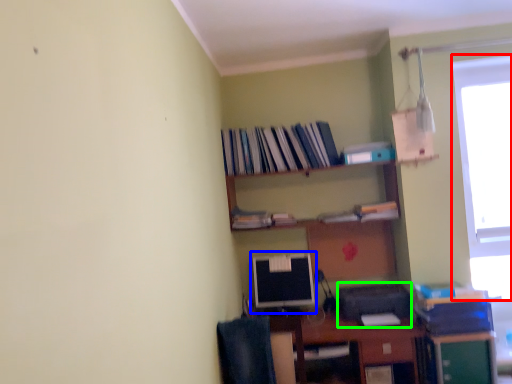
Question: Which object is the farthest from window (highlighted by a red box)? Choose among these: computer monitor (highlighted by a blue box) or printer (highlighted by a green box).

Choices:
 (A) computer monitor
 (B) printer

Answer: (A)